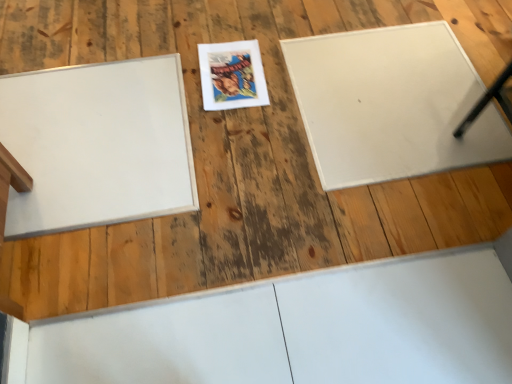
Question: From the image's perspective, is matte paper comic book at center under white matte board at left, which appears as the 2th bulletin board when viewed from the right?

Choices:
 (A) no
 (B) yes

Answer: (A)

Question: From the image's perspective, is matte paper comic book at center on white matte board at left, which appears as the 2th bulletin board when viewed from the right?

Choices:
 (A) yes
 (B) no

Answer: (A)

Question: Is matte paper comic book at center thinner than white matte board at left, which appears as the 2th bulletin board when viewed from the right?

Choices:
 (A) yes
 (B) no

Answer: (A)

Question: Is matte paper comic book at center surrounding white matte board at left, which appears as the 2th bulletin board when viewed from the right?

Choices:
 (A) no
 (B) yes

Answer: (A)

Question: Considering the relative sizes of matte paper comic book at center and white matte board at left, which is the first bulletin board in left-to-right order, in the image provided, is matte paper comic book at center taller than white matte board at left, which is the first bulletin board in left-to-right order,?

Choices:
 (A) yes
 (B) no

Answer: (A)

Question: Considering the positions of point (316, 66) and point (74, 104), is point (316, 66) closer or farther from the camera than point (74, 104)?

Choices:
 (A) closer
 (B) farther

Answer: (B)

Question: From their relative heights in the image, would you say white matte board at upper right, which is the 2th bulletin board in left-to-right order, is taller or shorter than white matte board at left, which is the first bulletin board in left-to-right order?

Choices:
 (A) short
 (B) tall

Answer: (A)

Question: From a real-world perspective, is white matte board at upper right, which is the 2th bulletin board in left-to-right order, physically located above or below white matte board at left, which is the first bulletin board in left-to-right order?

Choices:
 (A) above
 (B) below

Answer: (B)

Question: Is white matte board at upper right, which appears as the 1th bulletin board when viewed from the right, in front of or behind white matte board at left, which is the first bulletin board in left-to-right order, in the image?

Choices:
 (A) behind
 (B) front

Answer: (A)

Question: Is white matte board at upper right, which is the 2th bulletin board in left-to-right order, spatially inside matte paper comic book at center, or outside of it?

Choices:
 (A) outside
 (B) inside

Answer: (A)

Question: From a real-world perspective, is white matte board at upper right, which appears as the 1th bulletin board when viewed from the right, positioned above or below matte paper comic book at center?

Choices:
 (A) below
 (B) above

Answer: (A)

Question: In terms of size, does white matte board at upper right, which appears as the 1th bulletin board when viewed from the right, appear bigger or smaller than matte paper comic book at center?

Choices:
 (A) big
 (B) small

Answer: (A)

Question: From their relative heights in the image, would you say white matte board at upper right, which is the 2th bulletin board in left-to-right order, is taller or shorter than matte paper comic book at center?

Choices:
 (A) short
 (B) tall

Answer: (A)

Question: Is point (103, 148) positioned closer to the camera than point (421, 74)?

Choices:
 (A) farther
 (B) closer

Answer: (B)

Question: In terms of size, does white matte board at left, which appears as the 2th bulletin board when viewed from the right, appear bigger or smaller than white matte board at upper right, which appears as the 1th bulletin board when viewed from the right?

Choices:
 (A) big
 (B) small

Answer: (B)